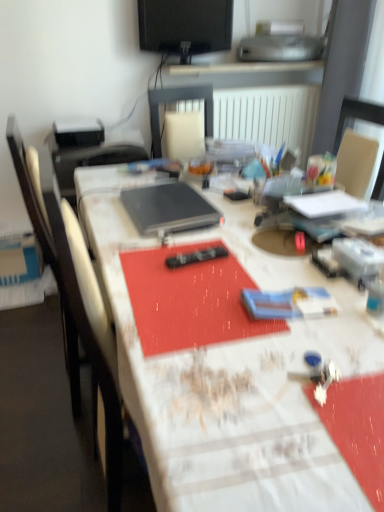
Question: Is black glossy monitor at upper center inside black matte laptop at center?

Choices:
 (A) no
 (B) yes

Answer: (A)

Question: Does black matte laptop at center have a smaller size compared to black glossy monitor at upper center?

Choices:
 (A) yes
 (B) no

Answer: (A)

Question: From the image's perspective, is black matte laptop at center under black glossy monitor at upper center?

Choices:
 (A) yes
 (B) no

Answer: (A)

Question: Does black matte laptop at center turn towards black glossy monitor at upper center?

Choices:
 (A) no
 (B) yes

Answer: (A)

Question: From a real-world perspective, is black matte laptop at center beneath black glossy monitor at upper center?

Choices:
 (A) yes
 (B) no

Answer: (A)

Question: Can you confirm if black matte laptop at center is positioned to the right of black glossy monitor at upper center?

Choices:
 (A) no
 (B) yes

Answer: (A)

Question: Would you say black matte laptop at center is outside white textured table at center?

Choices:
 (A) yes
 (B) no

Answer: (A)

Question: Is black matte laptop at center not close to white textured table at center?

Choices:
 (A) yes
 (B) no

Answer: (B)

Question: Is white textured table at center at the back of black matte laptop at center?

Choices:
 (A) no
 (B) yes

Answer: (A)

Question: From a real-world perspective, is black matte laptop at center positioned under white textured table at center based on gravity?

Choices:
 (A) yes
 (B) no

Answer: (B)

Question: Is black matte laptop at center with white textured table at center?

Choices:
 (A) no
 (B) yes

Answer: (A)

Question: From the image's perspective, is black matte laptop at center located above white textured table at center?

Choices:
 (A) no
 (B) yes

Answer: (B)

Question: Does white textured table at center have a larger size compared to black glossy monitor at upper center?

Choices:
 (A) yes
 (B) no

Answer: (A)